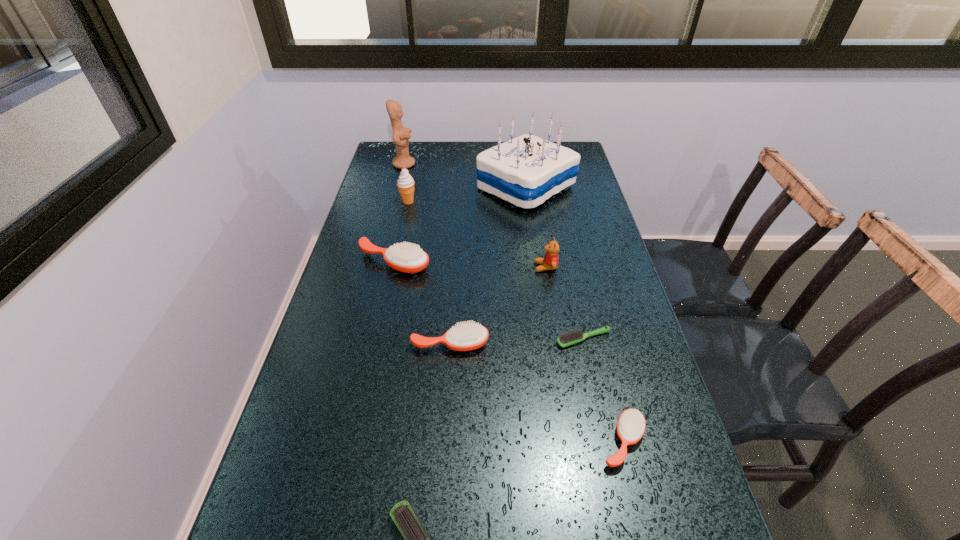
Find the location of a particular element. The height and width of the screenshot is (540, 960). figurine is located at coordinates (401, 135).

The width and height of the screenshot is (960, 540). I want to click on blue birthday cake, so click(527, 170).

The height and width of the screenshot is (540, 960). I want to click on icecream, so click(x=405, y=183).

The width and height of the screenshot is (960, 540). In order to click on the third tallest object in this screenshot , I will do `click(405, 183)`.

Where is `the sixth shortest object`? the sixth shortest object is located at coordinates (550, 261).

This screenshot has width=960, height=540. In order to click on red teddy bear in this screenshot , I will do `click(550, 261)`.

Identify the location of the tallest hairbrush. (408, 258).

This screenshot has width=960, height=540. I want to click on the biggest orange hairbrush, so click(408, 258).

What are the coordinates of `the second smallest orange hairbrush` in the screenshot? It's located at (469, 336).

This screenshot has width=960, height=540. I want to click on the fourth shortest hairbrush, so click(x=469, y=336).